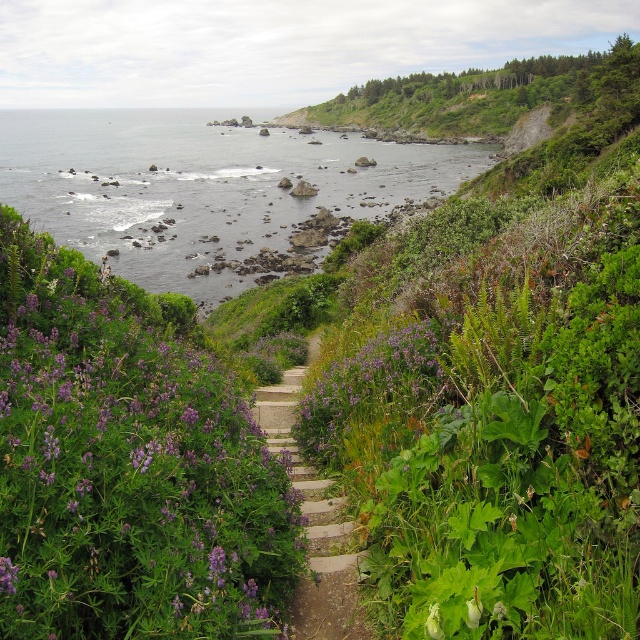
Question: Can you confirm if purple soft-textured flowers at center-left is bigger than purple matte flower at center?

Choices:
 (A) no
 (B) yes

Answer: (B)

Question: Is purple soft-textured flowers at center-left wider than purple matte flower at center?

Choices:
 (A) no
 (B) yes

Answer: (B)

Question: In this image, where is clear water at upper center located relative to purple matte flower at center?

Choices:
 (A) left
 (B) right

Answer: (A)

Question: Which object is closer to the camera taking this photo?

Choices:
 (A) purple soft-textured flowers at center-left
 (B) purple matte flower at center

Answer: (A)

Question: Which of these objects is positioned closest to the purple matte flower at center?

Choices:
 (A) clear water at upper center
 (B) purple soft-textured flowers at center-left

Answer: (B)

Question: Which point is closer to the camera?

Choices:
 (A) (381, 385)
 (B) (214, 566)

Answer: (B)